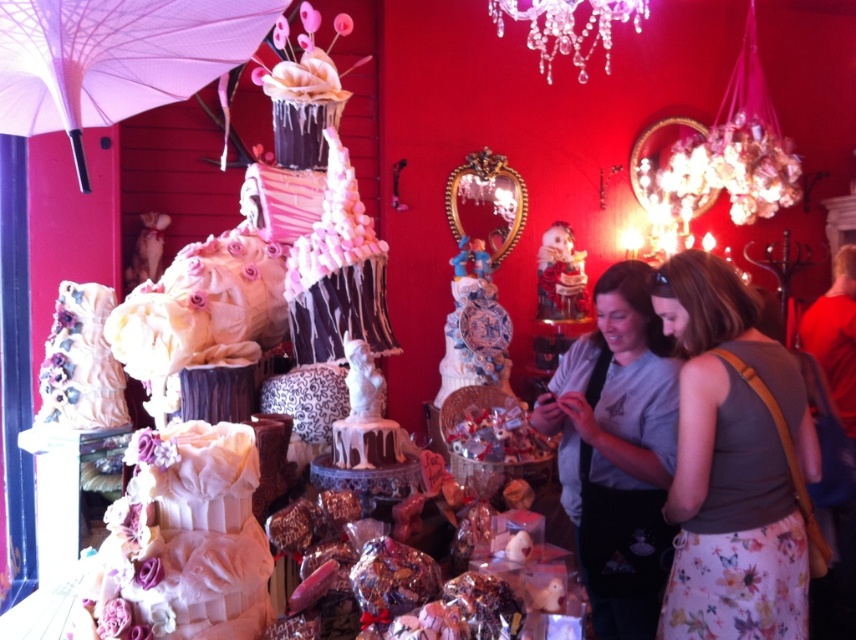
Question: Does matte gray tank top at center appear on the right side of white fabric cake at left?

Choices:
 (A) yes
 (B) no

Answer: (A)

Question: Which of the following is the closest to the observer?

Choices:
 (A) (85, 324)
 (B) (22, 26)
 (C) (742, 88)
 (D) (688, 323)

Answer: (B)

Question: Can you confirm if pink fabric umbrella at upper left is wider than crystal glass chandelier at upper center?

Choices:
 (A) no
 (B) yes

Answer: (B)

Question: Estimate the real-world distances between objects in this image. Which object is farther from the white fabric cake at left?

Choices:
 (A) matte gray tank top at center
 (B) white fabric cake at center
 (C) shiny metallic chandelier at upper right
 (D) crystal glass chandelier at upper center

Answer: (C)

Question: Observing the image, what is the correct spatial positioning of matte gray shirt at center in reference to pink fabric umbrella at upper left?

Choices:
 (A) right
 (B) left

Answer: (A)

Question: Which point is closer to the camera?

Choices:
 (A) crystal glass chandelier at upper center
 (B) matte gray shirt at center
 (C) white fabric cake at left
 (D) matte gray tank top at center

Answer: (D)